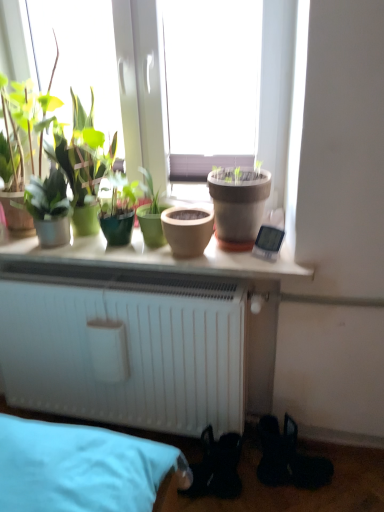
Question: Which direction should I rotate to look at matte clay pot at center, which is the second flowerpot from right to left, — up or down?

Choices:
 (A) up
 (B) down

Answer: (A)

Question: Is matte clay pot at center completely or partially outside of matte clay pot at center, which appears as the second flowerpot when viewed from the left?

Choices:
 (A) no
 (B) yes

Answer: (B)

Question: From the image's perspective, is matte clay pot at center on matte clay pot at center, which appears as the second flowerpot when viewed from the left?

Choices:
 (A) no
 (B) yes

Answer: (A)

Question: From a real-world perspective, is matte clay pot at center below matte clay pot at center, which appears as the second flowerpot when viewed from the left?

Choices:
 (A) no
 (B) yes

Answer: (B)

Question: Is matte clay pot at center taller than matte clay pot at center, which appears as the second flowerpot when viewed from the left?

Choices:
 (A) no
 (B) yes

Answer: (A)

Question: From the image's perspective, does matte clay pot at center appear lower than matte clay pot at center, which is counted as the first flowerpot, starting from the right?

Choices:
 (A) yes
 (B) no

Answer: (A)

Question: Is the position of matte clay pot at center more distant than that of matte clay pot at center, which appears as the second flowerpot when viewed from the left?

Choices:
 (A) no
 (B) yes

Answer: (A)

Question: Is green matte pot at center, positioned as the first houseplant in right-to-left order, in contact with matte clay pot at center, which appears as the second flowerpot when viewed from the left?

Choices:
 (A) no
 (B) yes

Answer: (A)

Question: Considering the relative sizes of green matte pot at center, the 2th houseplant when ordered from left to right, and matte clay pot at center, which appears as the second flowerpot when viewed from the left, in the image provided, is green matte pot at center, the 2th houseplant when ordered from left to right, wider than matte clay pot at center, which appears as the second flowerpot when viewed from the left,?

Choices:
 (A) no
 (B) yes

Answer: (A)

Question: Is green matte pot at center, the 2th houseplant when ordered from left to right, shorter than matte clay pot at center, which is counted as the first flowerpot, starting from the right?

Choices:
 (A) yes
 (B) no

Answer: (B)

Question: Does green matte pot at center, the 2th houseplant when ordered from left to right, have a greater height compared to matte clay pot at center, which is counted as the first flowerpot, starting from the right?

Choices:
 (A) yes
 (B) no

Answer: (A)

Question: Is green matte pot at center, the 2th houseplant when ordered from left to right, oriented away from matte clay pot at center, which appears as the second flowerpot when viewed from the left?

Choices:
 (A) yes
 (B) no

Answer: (B)

Question: Does green matte pot at center, the 2th houseplant when ordered from left to right, lie behind matte clay pot at center, which appears as the second flowerpot when viewed from the left?

Choices:
 (A) yes
 (B) no

Answer: (A)

Question: Is green matte plant at left, which is counted as the 2th houseplant, starting from the right, oriented towards matte clay pot at center, which is the second flowerpot from right to left?

Choices:
 (A) no
 (B) yes

Answer: (A)